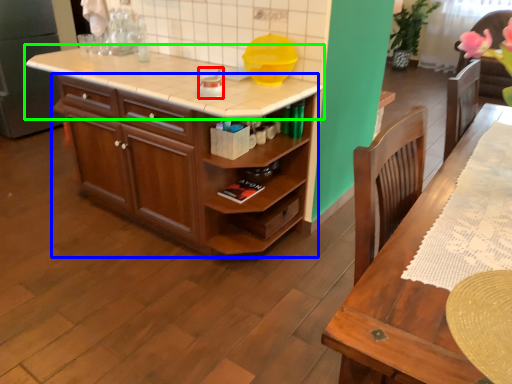
Question: Which is farther away from appliance (highlighted by a red box)? cabinetry (highlighted by a blue box) or countertop (highlighted by a green box)?

Choices:
 (A) cabinetry
 (B) countertop

Answer: (A)